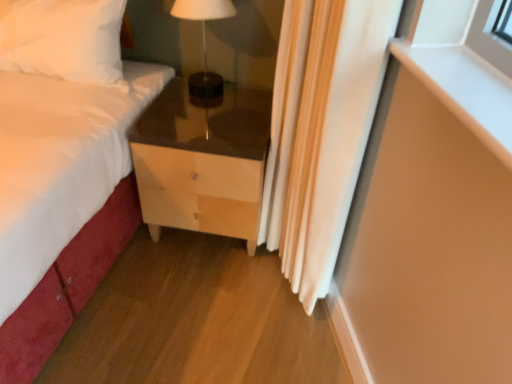
This screenshot has height=384, width=512. Identify the location of vacant area that is in front of white fabric curtain at right. tap(259, 341).